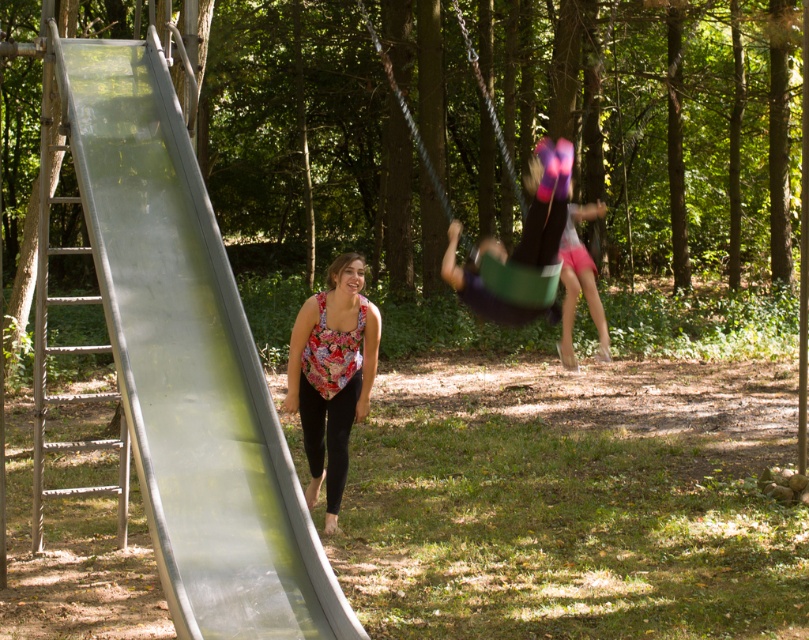
Describe the element at coordinates (189, 364) in the screenshot. The image size is (809, 640). I see `metallic smooth slide at left` at that location.

Consider the image. Does metallic smooth slide at left have a greater width compared to floral fabric top at center?

Indeed, metallic smooth slide at left has a greater width compared to floral fabric top at center.

Identify the location of metallic smooth slide at left. (189, 364).

Based on the photo, does metallic smooth slide at left have a lesser width compared to green plastic swing at center?

Yes, metallic smooth slide at left is thinner than green plastic swing at center.

Is point (174, 125) in front of point (538, 307)?

Yes, it is in front of point (538, 307).

Find the location of `metallic smooth slide at left`. metallic smooth slide at left is located at coordinates (189, 364).

Who is lower down, floral fabric top at center or green plastic swing at center?

floral fabric top at center

Does floral fabric top at center have a smaller size compared to green plastic swing at center?

Correct, floral fabric top at center occupies less space than green plastic swing at center.

This screenshot has width=809, height=640. What do you see at coordinates (332, 374) in the screenshot?
I see `floral fabric top at center` at bounding box center [332, 374].

You are a GUI agent. You are given a task and a screenshot of the screen. Output one action in this format:
    pyautogui.click(x=<x>, y=<y>)
    Task: Click on the floral fabric top at center
    This screenshot has height=640, width=809.
    Given the screenshot: What is the action you would take?
    pyautogui.click(x=332, y=374)